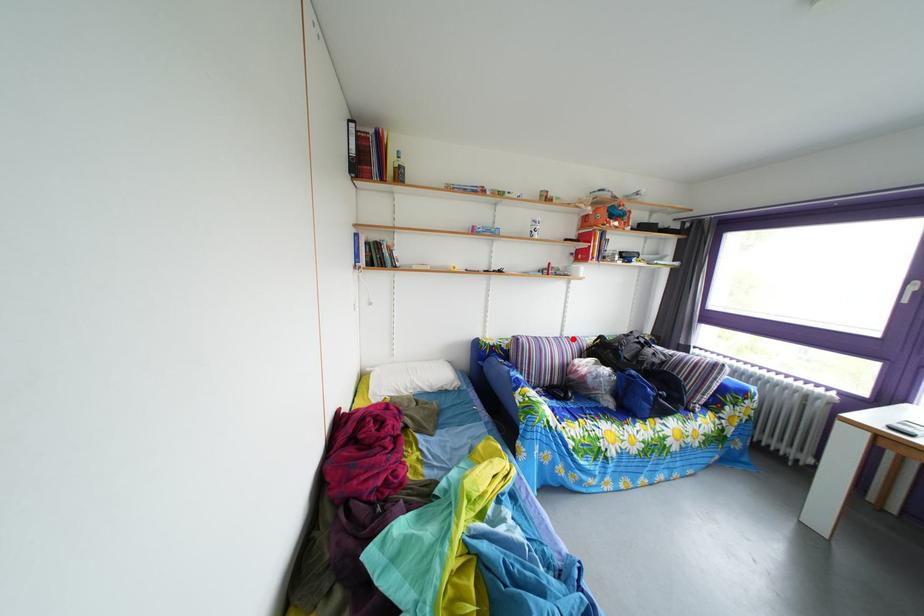
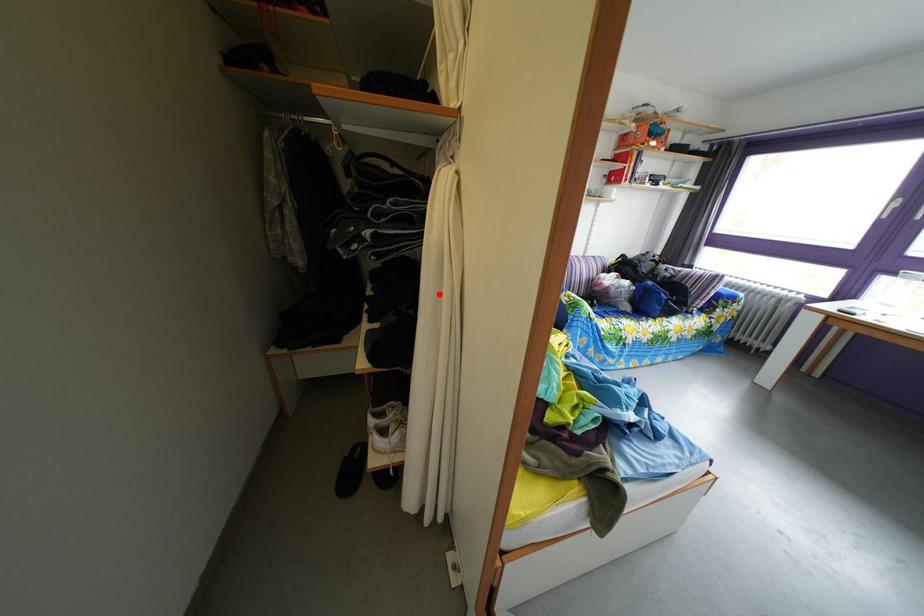
I am providing you with two images of the same scene from different viewpoints. A red point is marked on the first image and another point is marked on the second image. Is the marked point in image1 the same physical position as the marked point in image2?

No